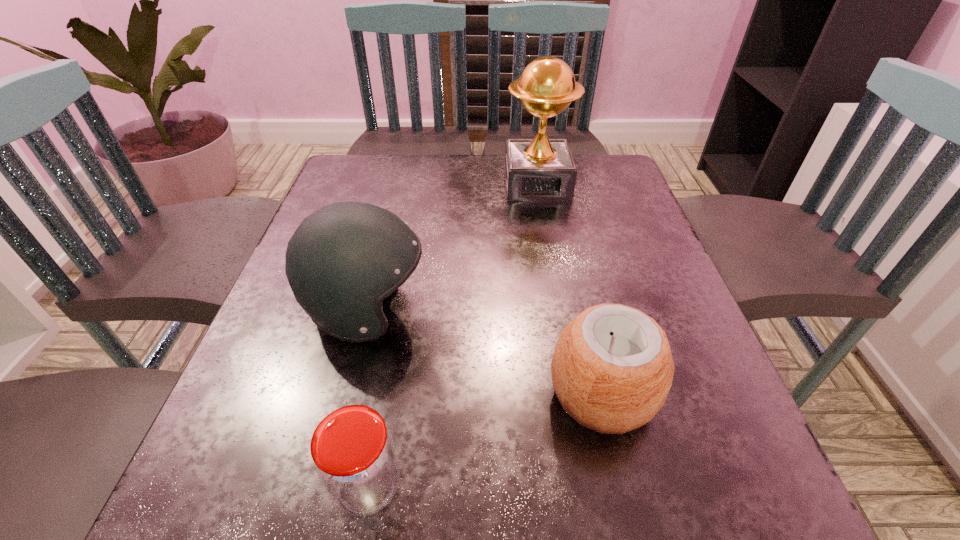
This screenshot has height=540, width=960. What are the coordinates of `free space between the shortest object and the football helmet` in the screenshot? It's located at (368, 397).

Where is `unoccupied area between the farthest object and the jar`? The width and height of the screenshot is (960, 540). unoccupied area between the farthest object and the jar is located at coordinates (452, 335).

Locate an element on the screen. The width and height of the screenshot is (960, 540). vacant area between the coconut and the nearest object is located at coordinates point(485,440).

Locate an element on the screen. blank region between the shortest object and the football helmet is located at coordinates (368, 397).

This screenshot has height=540, width=960. In order to click on the second closest object relative to the football helmet in this screenshot , I will do `click(612, 368)`.

Where is `object that is the third closest one to the award`? The width and height of the screenshot is (960, 540). object that is the third closest one to the award is located at coordinates point(354,456).

The image size is (960, 540). I want to click on vacant area in the image that satisfies the following two spatial constraints: 1. at the face opening of the football helmet; 2. on the back side of the nearest object, so pyautogui.click(x=323, y=485).

Identify the location of free space that satisfies the following two spatial constraints: 1. at the face opening of the coconut; 2. on the right side of the football helmet. The height and width of the screenshot is (540, 960). (346, 395).

The image size is (960, 540). In order to click on free spot that satisfies the following two spatial constraints: 1. on the back side of the coconut; 2. on the left side of the jar in this screenshot , I will do `click(384, 395)`.

Locate an element on the screen. The width and height of the screenshot is (960, 540). free space that satisfies the following two spatial constraints: 1. on the back side of the coconut; 2. at the face opening of the football helmet is located at coordinates (582, 309).